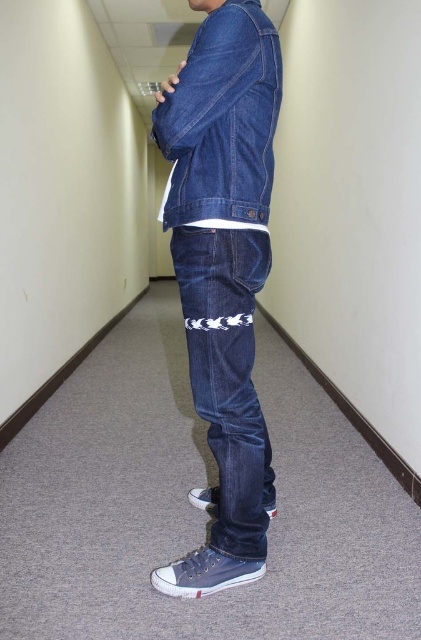
Does denim jeans at center appear under dark blue denim jeans at center?

No, denim jeans at center is not below dark blue denim jeans at center.

Based on the photo, between denim jeans at center and dark blue denim jeans at center, which one appears on the right side from the viewer's perspective?

Positioned to the right is dark blue denim jeans at center.

The image size is (421, 640). In order to click on denim jeans at center in this screenshot , I will do `click(223, 272)`.

Between denim jeans at center and denim jacket at center, which one appears on the right side from the viewer's perspective?

denim jacket at center is more to the right.

I want to click on denim jeans at center, so click(x=223, y=272).

The image size is (421, 640). What do you see at coordinates (228, 374) in the screenshot?
I see `dark blue denim jeans at center` at bounding box center [228, 374].

Based on the photo, who is shorter, dark blue denim jeans at center or denim jacket at center?

denim jacket at center

The image size is (421, 640). What are the coordinates of `dark blue denim jeans at center` in the screenshot? It's located at (228, 374).

Where is `dark blue denim jeans at center`? The width and height of the screenshot is (421, 640). dark blue denim jeans at center is located at coordinates (228, 374).